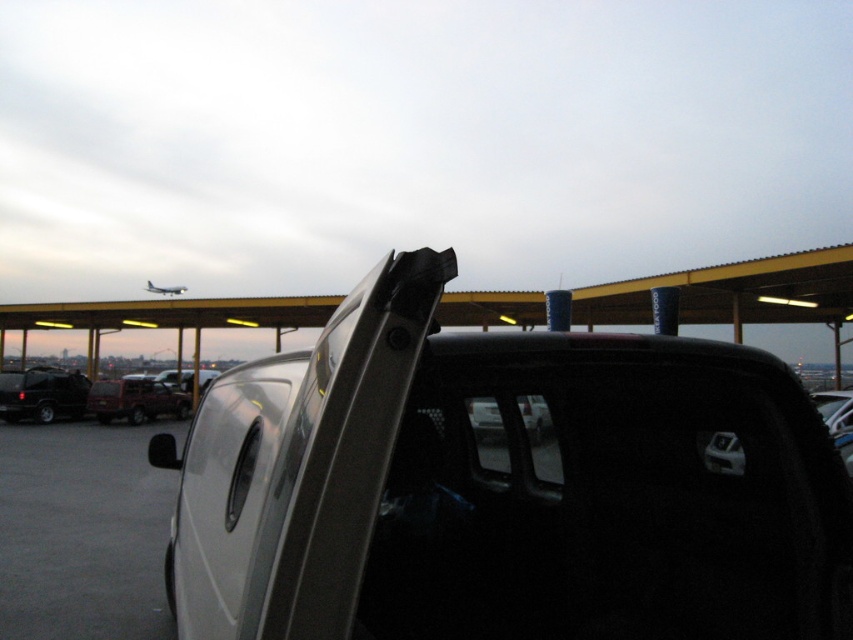
Question: Is matte black suv at left to the left of matte black car door at center from the viewer's perspective?

Choices:
 (A) no
 (B) yes

Answer: (B)

Question: Which point is farther from the camera taking this photo?

Choices:
 (A) (152, 396)
 (B) (473, 388)
 (C) (3, 381)

Answer: (A)

Question: Does satin silver pickup at center appear over matte black suv at left?

Choices:
 (A) yes
 (B) no

Answer: (A)

Question: Which point is closer to the camera?

Choices:
 (A) satin silver pickup at center
 (B) matte red pickup truck at center
 (C) matte black suv at left
 (D) matte black car door at center

Answer: (A)

Question: Which of the following is the closest to the observer?

Choices:
 (A) matte black car door at center
 (B) matte black suv at left

Answer: (A)

Question: Is matte black suv at left thinner than matte red pickup truck at center?

Choices:
 (A) no
 (B) yes

Answer: (A)